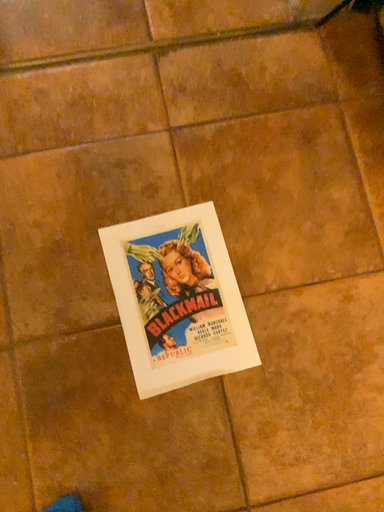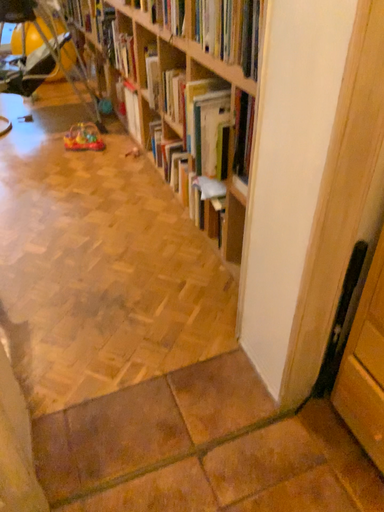
Question: How did the camera likely rotate when shooting the video?

Choices:
 (A) rotated downward
 (B) rotated upward

Answer: (B)